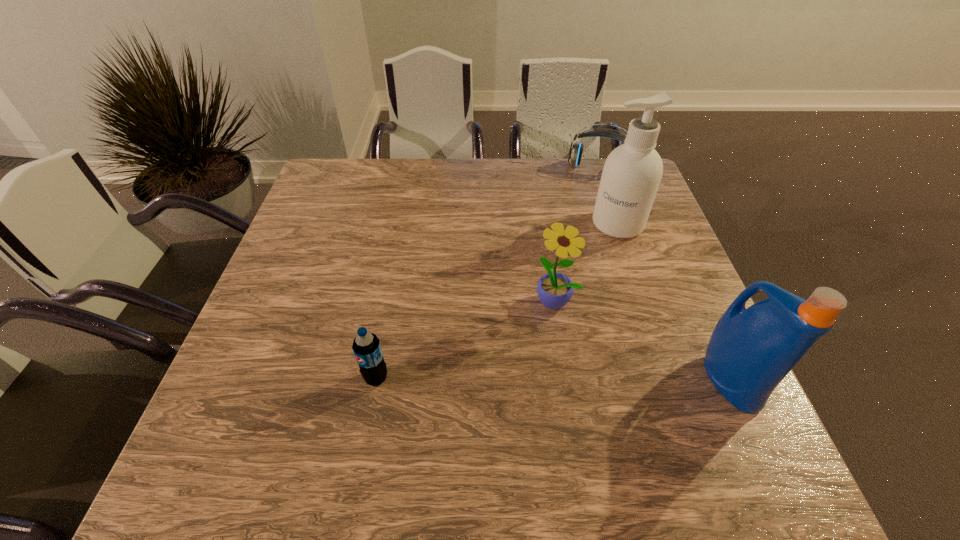
Locate an element on the screen. The width and height of the screenshot is (960, 540). the second closest object relative to the detergent is located at coordinates (632, 172).

At what (x,y) coordinates should I click in order to perform the action: click on free space that satisfies the following two spatial constraints: 1. on the back side of the leftmost object; 2. on the left side of the sunflower. Please return your answer as a coordinate pair (x, y). This screenshot has width=960, height=540. Looking at the image, I should click on (391, 300).

Find the location of a particular element. vacant space that satisfies the following two spatial constraints: 1. on the back side of the leftmost object; 2. on the left side of the second farthest object is located at coordinates (405, 224).

Where is `free space that satisfies the following two spatial constraints: 1. on the front side of the second tallest object; 2. on the label of the sunflower`? The height and width of the screenshot is (540, 960). free space that satisfies the following two spatial constraints: 1. on the front side of the second tallest object; 2. on the label of the sunflower is located at coordinates (567, 379).

The image size is (960, 540). I want to click on free space that satisfies the following two spatial constraints: 1. on the back side of the fourth object from right to left; 2. on the left side of the soda bottle, so click(391, 300).

Find the location of `vacant point that satisfies the following two spatial constraints: 1. on the front side of the headset; 2. on the right side of the tallest object`. vacant point that satisfies the following two spatial constraints: 1. on the front side of the headset; 2. on the right side of the tallest object is located at coordinates (617, 224).